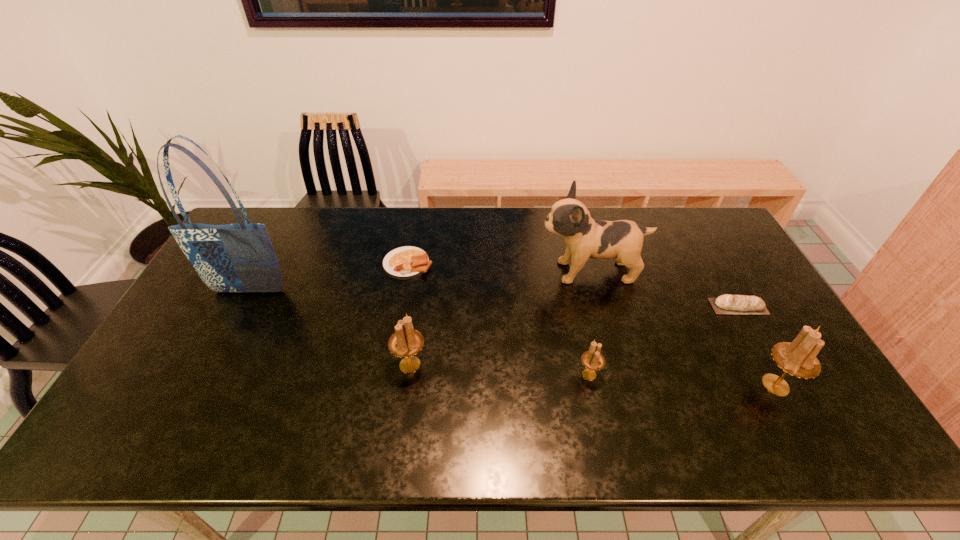
Find the location of a particular element. the second shortest candle holder is located at coordinates (405, 342).

The image size is (960, 540). In order to click on the fourth shortest object in this screenshot , I will do pos(405,342).

The width and height of the screenshot is (960, 540). What are the coordinates of `the second candle holder from right to left` in the screenshot? It's located at (593, 360).

This screenshot has width=960, height=540. I want to click on the third shortest object, so click(x=593, y=360).

This screenshot has height=540, width=960. I want to click on the rightmost candle holder, so click(798, 358).

You are a GUI agent. You are given a task and a screenshot of the screen. Output one action in this format:
    pyautogui.click(x=<x>, y=<y>)
    Task: Click on the omelet
    The height and width of the screenshot is (540, 960).
    Given the screenshot: What is the action you would take?
    pyautogui.click(x=407, y=262)

The image size is (960, 540). In order to click on the fourth farthest object in this screenshot , I will do coord(725,304).

The width and height of the screenshot is (960, 540). In order to click on pita bread in this screenshot , I will do `click(725, 304)`.

In order to click on puppy in this screenshot , I will do `click(585, 237)`.

At what (x,y) coordinates should I click in order to perform the action: click on shopping bag. Please return your answer as a coordinate pair (x, y). The image size is (960, 540). Looking at the image, I should click on (240, 257).